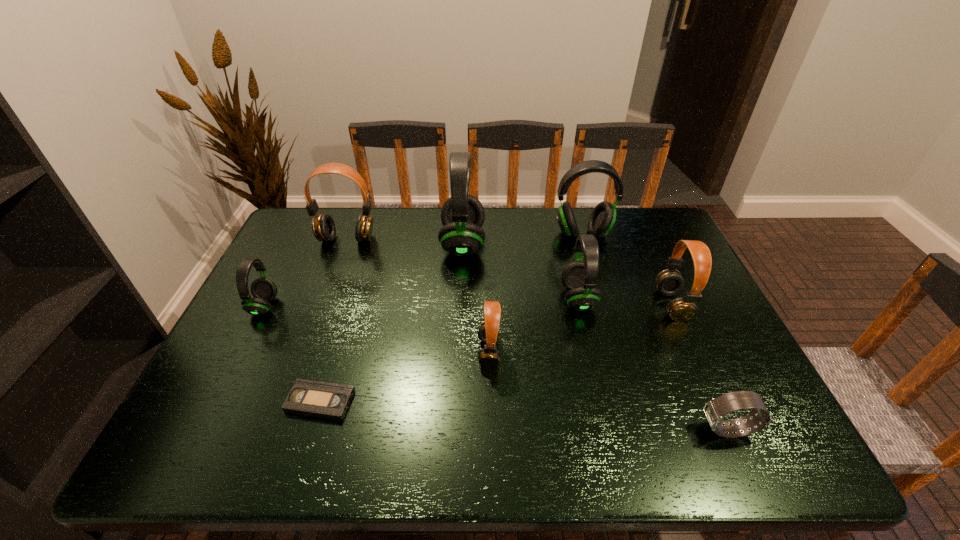
Image resolution: width=960 pixels, height=540 pixels. I want to click on the leftmost black headset, so click(x=263, y=289).

Find the location of `the smallest black headset`. the smallest black headset is located at coordinates (263, 289).

What are the coordinates of `the second shortest object` in the screenshot? It's located at (715, 410).

You are a GUI agent. You are given a task and a screenshot of the screen. Output one action in this format:
    pyautogui.click(x=<x>, y=<y>)
    Task: Click on the shortest object
    The image size is (960, 540).
    Given the screenshot: What is the action you would take?
    pyautogui.click(x=312, y=398)

At what (x,y) coordinates should I click in order to perform the action: click on free space located 0.350m on the ear cups of the tallest object. Please return your answer as a coordinate pair (x, y). Looking at the image, I should click on (593, 244).

This screenshot has height=540, width=960. What are the coordinates of `vacant region located 0.250m on the ear cups of the second biggest black headset` in the screenshot? It's located at (601, 299).

Where is `vacant space located 0.250m on the ear cups of the biggest brown headset`? This screenshot has width=960, height=540. vacant space located 0.250m on the ear cups of the biggest brown headset is located at coordinates pos(324,303).

Locate an element on the screen. free space located 0.370m on the ear cups of the second farthest brown headset is located at coordinates (525, 305).

Where is `vacant point located 0.140m on the ear cups of the second farthest brown headset`? The width and height of the screenshot is (960, 540). vacant point located 0.140m on the ear cups of the second farthest brown headset is located at coordinates (609, 305).

Find the location of a particular element. This screenshot has width=960, height=540. free space located on the ear cups of the second farthest brown headset is located at coordinates (576, 305).